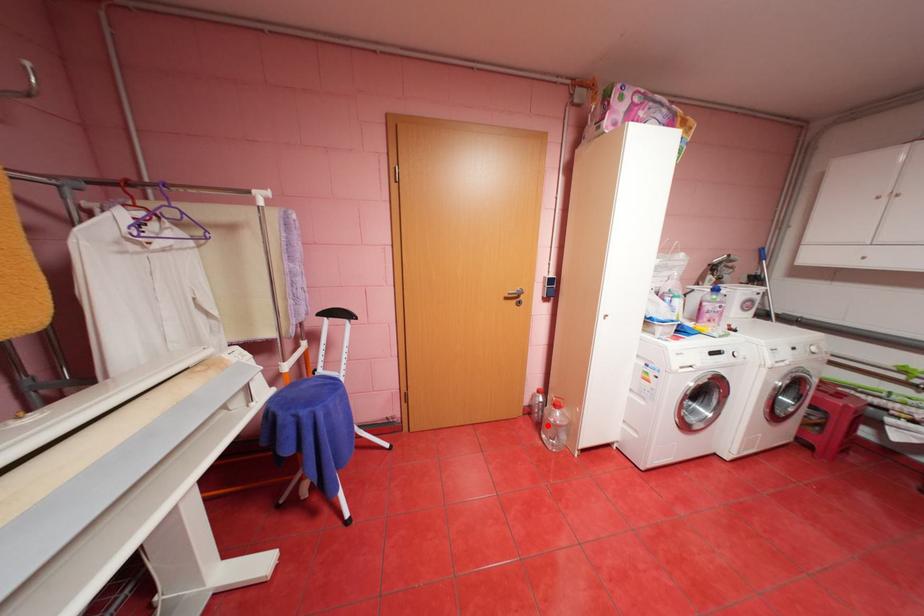
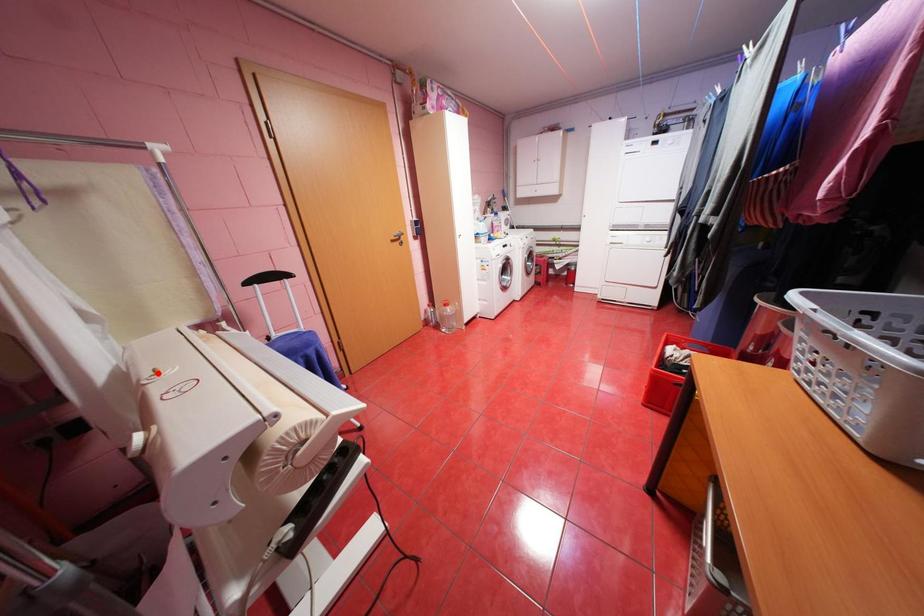
Consider the image. I am providing you with two images of the same scene from different viewpoints. A red point is marked on the first image and another point is marked on the second image. Are the points marked in image1 and image2 representing the same 3D position?

No